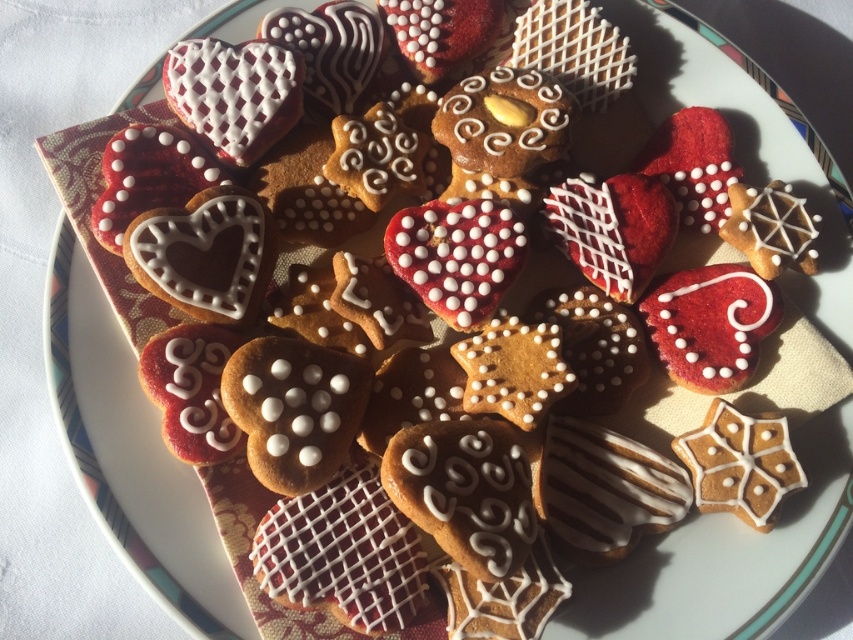
Which is more to the left, golden sugar-coated star at center or matte white star at upper right?

From the viewer's perspective, golden sugar-coated star at center appears more on the left side.

Does golden sugar-coated star at center have a greater width compared to matte white star at upper right?

Correct, the width of golden sugar-coated star at center exceeds that of matte white star at upper right.

Which is behind, point (746, 456) or point (785, 198)?

The point (785, 198) is more distant.

Image resolution: width=853 pixels, height=640 pixels. Find the location of `golden sugar-coated star at center`. golden sugar-coated star at center is located at coordinates (740, 464).

Which is more to the left, white icing gingerbread at center or white sugar-coated star at center?

white icing gingerbread at center is more to the left.

Between white icing gingerbread at center and white sugar-coated star at center, which one has less height?

white sugar-coated star at center

This screenshot has height=640, width=853. What do you see at coordinates (343, 552) in the screenshot? I see `white icing gingerbread at center` at bounding box center [343, 552].

Find the location of a particular element. The height and width of the screenshot is (640, 853). white icing gingerbread at center is located at coordinates (343, 552).

Which is below, golden sugar-coated star at center or white sugar-coated star at center?

golden sugar-coated star at center is lower down.

Does golden sugar-coated star at center lie behind white sugar-coated star at center?

No.

Between point (718, 461) and point (537, 404), which one is positioned behind?

Point (537, 404)

Where is `golden sugar-coated star at center`? The image size is (853, 640). golden sugar-coated star at center is located at coordinates (740, 464).